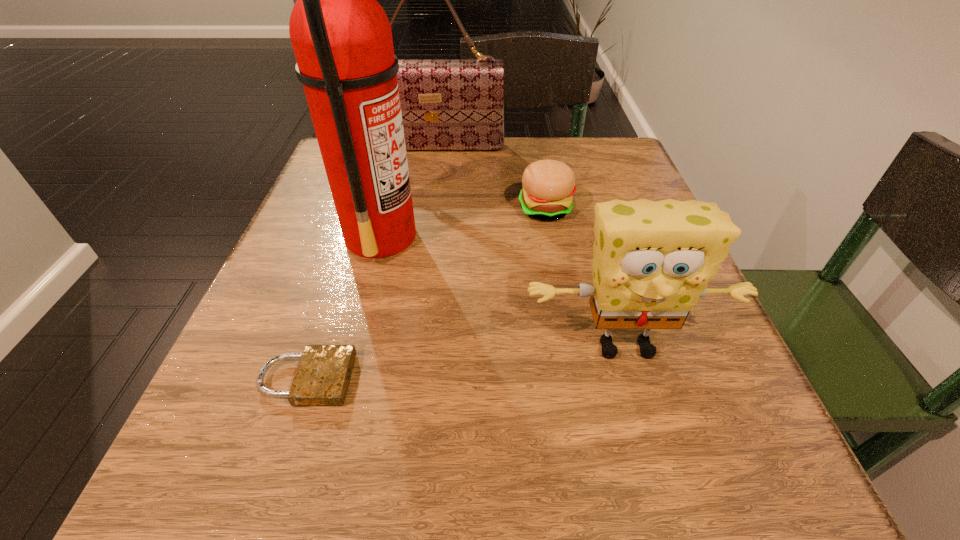
I want to click on free spot between the third shortest object and the second tallest object, so click(x=530, y=247).

This screenshot has height=540, width=960. What are the coordinates of `free space that is in between the third tallest object and the handbag` in the screenshot? It's located at (530, 247).

This screenshot has height=540, width=960. In order to click on empty location between the padlock and the farthest object in this screenshot , I will do `click(371, 264)`.

The height and width of the screenshot is (540, 960). In order to click on blank region between the fourth tallest object and the farthest object in this screenshot , I will do `click(491, 178)`.

Identify which object is the third nearest to the fire extinguisher. Please provide its 2D coordinates. Your answer should be formatted as a tuple, i.e. [(x, y)], where the tuple contains the x and y coordinates of a point satisfying the conditions above.

[(548, 185)]

Identify which object is located as the second nearest to the handbag. Please provide its 2D coordinates. Your answer should be formatted as a tuple, i.e. [(x, y)], where the tuple contains the x and y coordinates of a point satisfying the conditions above.

[(342, 40)]

You are a GUI agent. You are given a task and a screenshot of the screen. Output one action in this format:
    pyautogui.click(x=<x>, y=<y>)
    Task: Click on the free region that satisfies the following two spatial constraints: 1. on the front of the second tallest object with the clasp; 2. on the keyhole side of the padlock
    
    Given the screenshot: What is the action you would take?
    pyautogui.click(x=401, y=379)

Find the location of a particular element. The image size is (960, 540). vacant space that satisfies the following two spatial constraints: 1. on the front of the second tallest object with the clasp; 2. on the left side of the hamburger is located at coordinates (426, 209).

Locate an element on the screen. This screenshot has height=540, width=960. free location that satisfies the following two spatial constraints: 1. on the face of the third shortest object; 2. on the keyhole side of the padlock is located at coordinates (635, 379).